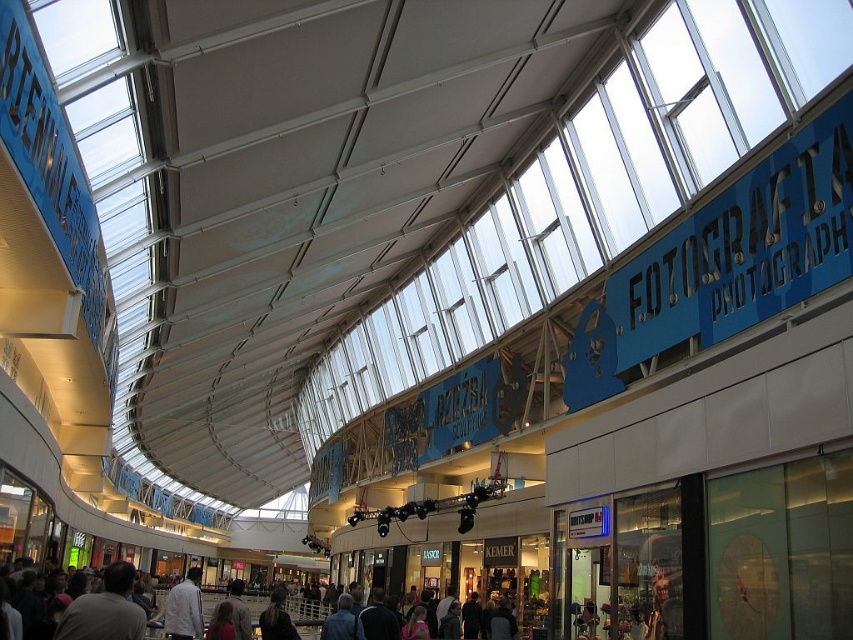
Question: Among these objects, which one is nearest to the camera?

Choices:
 (A) light brown leather jacket at center
 (B) dark brown leather jacket at center

Answer: (A)

Question: Considering the real-world distances, which object is farthest from the white shirt at center?

Choices:
 (A) light brown leather jacket at center
 (B) dark brown leather jacket at center

Answer: (A)

Question: Does light brown leather jacket at center have a smaller size compared to dark brown leather jacket at center?

Choices:
 (A) no
 (B) yes

Answer: (B)

Question: Which object appears closest to the camera in this image?

Choices:
 (A) white shirt at center
 (B) light brown leather jacket at center
 (C) dark brown leather jacket at center

Answer: (B)

Question: From the image, what is the correct spatial relationship of white shirt at center in relation to dark brown leather jacket at center?

Choices:
 (A) below
 (B) above

Answer: (B)

Question: Is the position of light brown leather jacket at center more distant than that of white shirt at center?

Choices:
 (A) no
 (B) yes

Answer: (A)